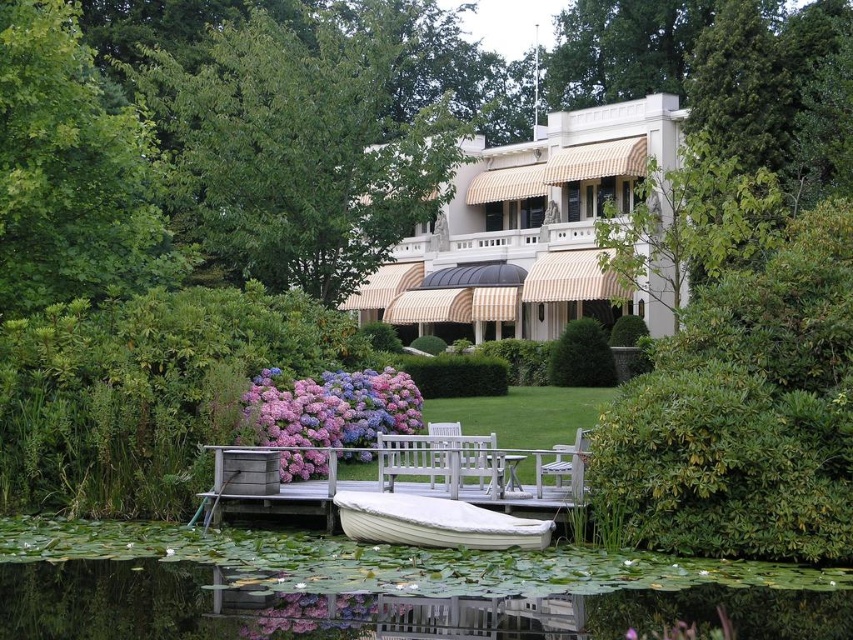
Between wooden chair at center and white wood bench at center, which one appears on the right side from the viewer's perspective?

Positioned to the right is wooden chair at center.

Measure the distance between wooden chair at center and camera.

wooden chair at center is 21.89 meters from camera.

What are the coordinates of `wooden chair at center` in the screenshot? It's located at (566, 465).

Is point (80, 70) positioned in front of point (550, 461)?

No.

Where is `green leafy tree at left`? The width and height of the screenshot is (853, 640). green leafy tree at left is located at coordinates (73, 170).

Between point (73, 272) and point (555, 481), which one is positioned behind?

Point (73, 272)

Find the location of a particular element. This screenshot has width=853, height=640. green leafy tree at left is located at coordinates (73, 170).

Which is behind, point (544, 451) or point (436, 420)?

The point (436, 420) is behind.

Image resolution: width=853 pixels, height=640 pixels. What are the coordinates of `white wood dock at center` in the screenshot? It's located at (413, 476).